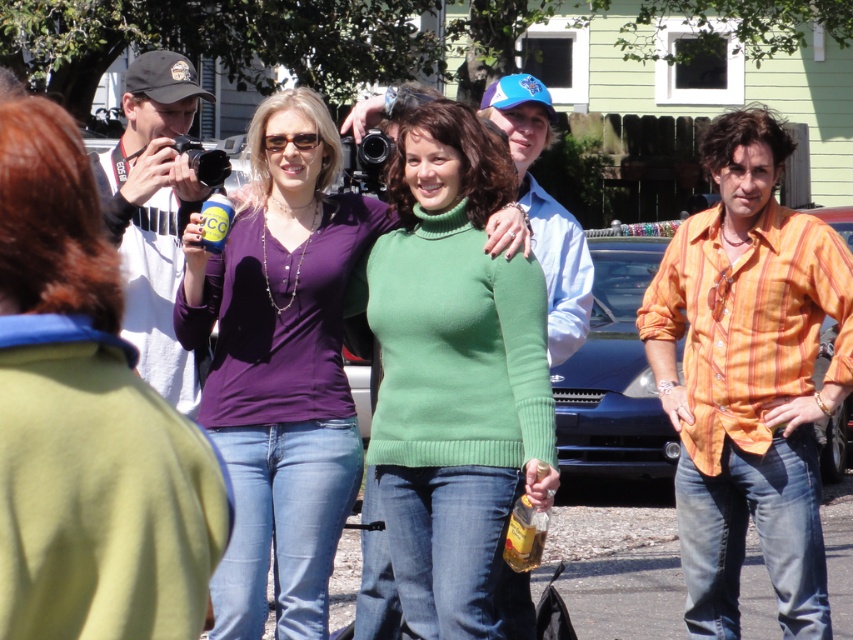
Is green knitted sweater at center thinner than orange striped shirt at right?

Indeed, green knitted sweater at center has a lesser width compared to orange striped shirt at right.

Between green knitted sweater at center and orange striped shirt at right, which one has less height?

With less height is orange striped shirt at right.

Between point (410, 172) and point (694, 416), which one is positioned in front?

Point (410, 172) is more forward.

Where is `green knitted sweater at center`? green knitted sweater at center is located at coordinates (450, 385).

Is orange striped shirt at right to the left of white cotton t-shirt at left from the viewer's perspective?

Incorrect, orange striped shirt at right is not on the left side of white cotton t-shirt at left.

Between orange striped shirt at right and white cotton t-shirt at left, which one has more height?

Standing taller between the two is orange striped shirt at right.

What do you see at coordinates (749, 378) in the screenshot? The image size is (853, 640). I see `orange striped shirt at right` at bounding box center [749, 378].

At what (x,y) coordinates should I click in order to perform the action: click on orange striped shirt at right. Please return your answer as a coordinate pair (x, y). This screenshot has height=640, width=853. Looking at the image, I should click on (749, 378).

I want to click on matte black camera at left, so click(86, 422).

Where is `matte black camera at left`? Image resolution: width=853 pixels, height=640 pixels. matte black camera at left is located at coordinates (86, 422).